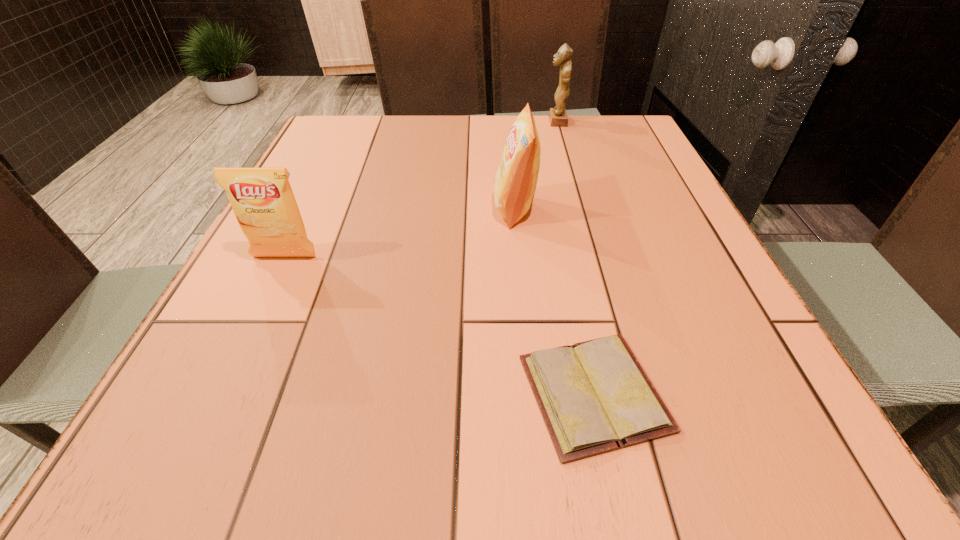
This screenshot has width=960, height=540. In order to click on figurine in this screenshot , I will do `click(558, 117)`.

Find the location of a particular element. the farther crisp (potato chip) is located at coordinates coord(515,182).

Where is `the third nearest object`? the third nearest object is located at coordinates (515, 182).

Where is `the second nearest object`? the second nearest object is located at coordinates (262, 199).

In order to click on the nearer crisp (potato chip) in this screenshot , I will do `click(262, 199)`.

In order to click on the shortest object in this screenshot , I will do `click(594, 396)`.

This screenshot has height=540, width=960. In order to click on the nearest object in this screenshot , I will do pyautogui.click(x=594, y=396).

You are a GUI agent. You are given a task and a screenshot of the screen. Output one action in this format:
    pyautogui.click(x=<x>, y=<y>)
    Task: Click on the vacant space located on the front-facing side of the figurine
    This screenshot has width=960, height=540.
    Given the screenshot: What is the action you would take?
    pyautogui.click(x=422, y=122)

Where is `free spot located on the front-facing side of the figurine`? free spot located on the front-facing side of the figurine is located at coordinates (510, 122).

Where is `vacant space located 0.280m on the front-facing side of the figurine`? vacant space located 0.280m on the front-facing side of the figurine is located at coordinates (452, 122).